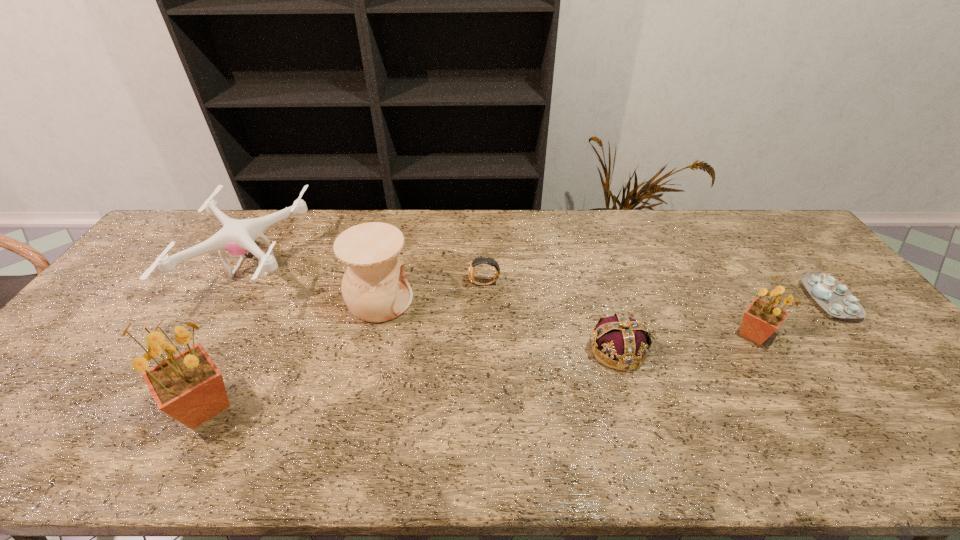
Identify the location of vacant space that satisfies the following two spatial constraints: 1. on the face of the crown; 2. on the right side of the second shortest object. (486, 350).

This screenshot has height=540, width=960. I want to click on free space that satisfies the following two spatial constraints: 1. on the face of the fifth tallest object; 2. on the left side of the watch, so click(486, 350).

Where is `free location that satisfies the following two spatial constraints: 1. on the face of the sixth tallest object; 2. on the right side of the chinaware`? The height and width of the screenshot is (540, 960). free location that satisfies the following two spatial constraints: 1. on the face of the sixth tallest object; 2. on the right side of the chinaware is located at coordinates (485, 300).

Where is `vacant space that satisfies the following two spatial constraints: 1. on the top of the fourth tallest object; 2. on the left side of the chinaware`? vacant space that satisfies the following two spatial constraints: 1. on the top of the fourth tallest object; 2. on the left side of the chinaware is located at coordinates (234, 300).

I want to click on free space in the image that satisfies the following two spatial constraints: 1. on the front side of the fifth tallest object; 2. at the front of the nearer sunflower with flowers visible, so pos(634,407).